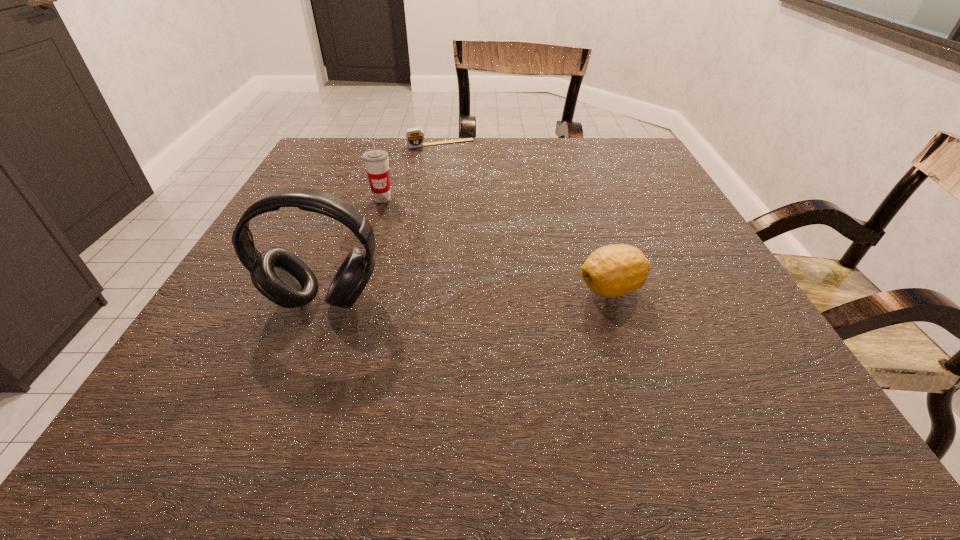
What are the coordinates of `free location located at the stem end of the rightmost object` in the screenshot? It's located at (395, 289).

Find the location of a particular element. Image resolution: width=960 pixels, height=540 pixels. vacant space located 0.240m on the side of the cup with the logo is located at coordinates (418, 267).

In order to click on vacant space located on the side of the cup with the logo in this screenshot , I will do `click(424, 280)`.

This screenshot has width=960, height=540. In order to click on blank area located 0.280m on the side of the cup with the logo in this screenshot , I will do `click(424, 280)`.

Identify the location of vacant region located 0.170m at the front of the tape measure with the tape extended. The height and width of the screenshot is (540, 960). (462, 178).

Where is `vacant space positioned 0.160m at the front of the tape measure with the tape extended`? This screenshot has width=960, height=540. vacant space positioned 0.160m at the front of the tape measure with the tape extended is located at coordinates pyautogui.click(x=461, y=176).

This screenshot has height=540, width=960. In order to click on vacant space situated 0.070m at the front of the tape measure with the tape extended in this screenshot , I will do `click(453, 160)`.

Where is `object that is at the far edge`? object that is at the far edge is located at coordinates (414, 137).

Identify the location of object that is at the left edge. (279, 275).

Identify the location of object situated at the right edge. The width and height of the screenshot is (960, 540). (614, 270).